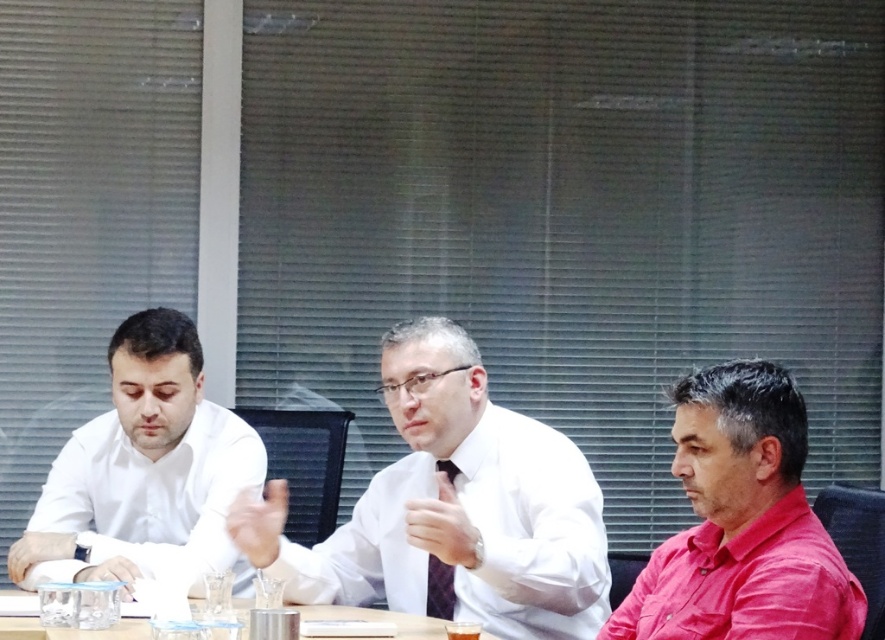
You are observing a meeting scene from the image. There are two points marked in the scene, one at coordinates point (641, 588) and another at point (437, 467). Which of these two points is nearer to your viewpoint?

Point (641, 588) is closer to the camera than point (437, 467), so the point at coordinates point (641, 588) is nearer to your viewpoint.

Based on the scene description, can you determine the spatial relationship between the white glossy shirt at left and the clear plastic cups at center? Specifically, is the shirt positioned above or below the cups?

The white glossy shirt at left is above the clear plastic cups at center according to the description.